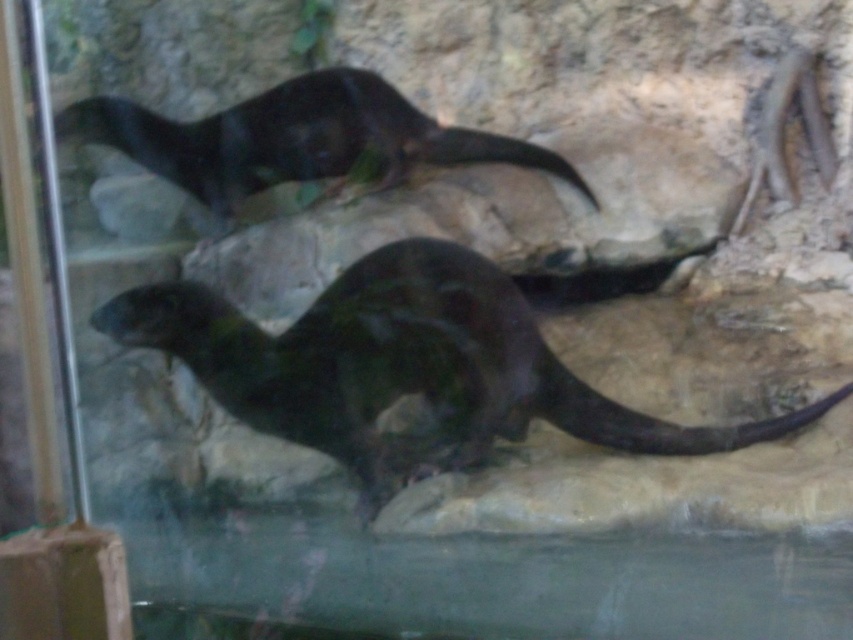
You are a zookeeper observing the otters in their enclosure. You notice two shiny black otters in the exhibit. How far apart are the shiny black otter at center and the shiny black otter at upper center?

The shiny black otter at center is 24.68 inches from the shiny black otter at upper center.

You are standing at the entrance of the otter exhibit and want to observe both point (x=766, y=433) and point (x=109, y=140). Which point will you see first when looking from your current position?

Point (x=766, y=433) is in front of point (x=109, y=140), so you will see point (x=766, y=433) first.

You are a zookeeper observing the otters in their rocky enclosure. You notice two shiny black otters in the exhibit. Which otter, the shiny black otter at center or the shiny black otter at upper center, is bigger in size?

The shiny black otter at center is larger in size compared to the shiny black otter at upper center.